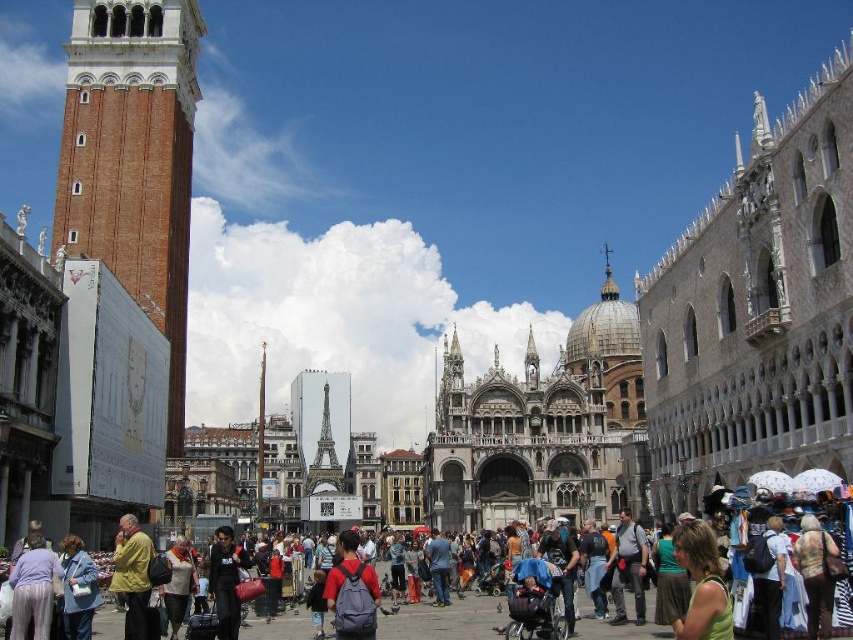
Is matte black backpacks at center to the right of denim jacket at lower left from the viewer's perspective?

Correct, you'll find matte black backpacks at center to the right of denim jacket at lower left.

Is point (619, 637) more distant than point (79, 548)?

Yes, point (619, 637) is behind point (79, 548).

In order to click on matte black backpacks at center in this screenshot , I will do `click(445, 620)`.

Is point (837, 595) closer to viewer compared to point (810, 586)?

No, (837, 595) is behind (810, 586).

Which is more to the left, matte black backpacks at center or brown leather backpack at lower right?

Positioned to the left is matte black backpacks at center.

What do you see at coordinates (445, 620) in the screenshot? I see `matte black backpacks at center` at bounding box center [445, 620].

The image size is (853, 640). What are the coordinates of `matte black backpacks at center` in the screenshot? It's located at (445, 620).

Between point (79, 538) and point (343, 579), which one is positioned in front?

Positioned in front is point (343, 579).

How much distance is there between denim jacket at lower left and matte gray backpack at center?

denim jacket at lower left and matte gray backpack at center are 43.28 feet apart.

Between point (80, 560) and point (335, 595), which one is positioned behind?

The point (335, 595) is behind.

Identify the location of denim jacket at lower left. The height and width of the screenshot is (640, 853). (78, 588).